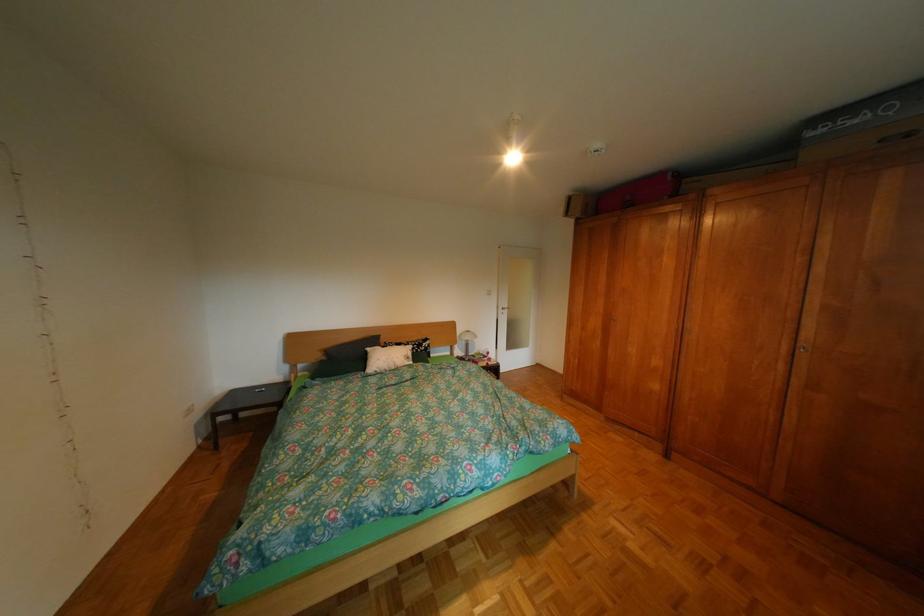
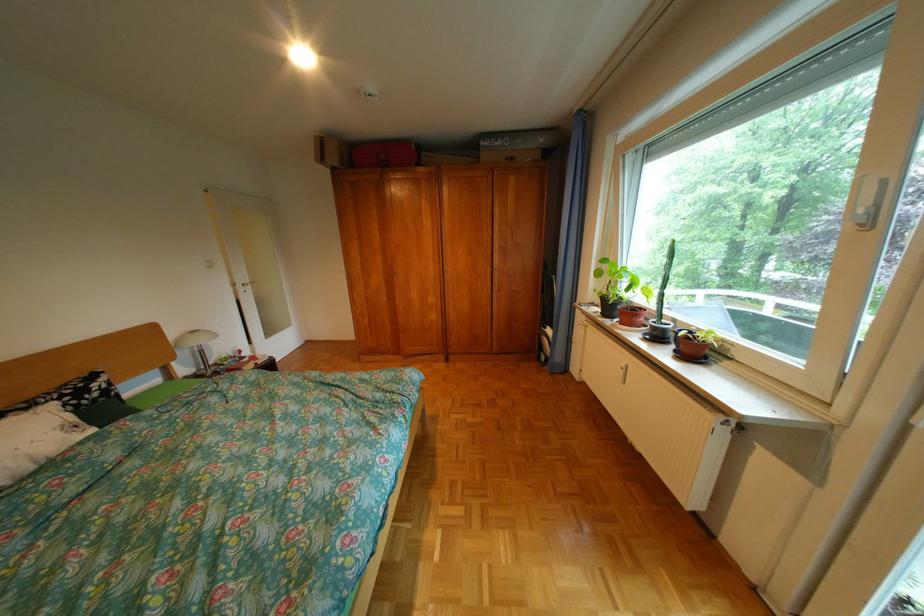
Locate, in the second image, the point that corresponds to (x=610, y=323) in the first image.

(392, 280)